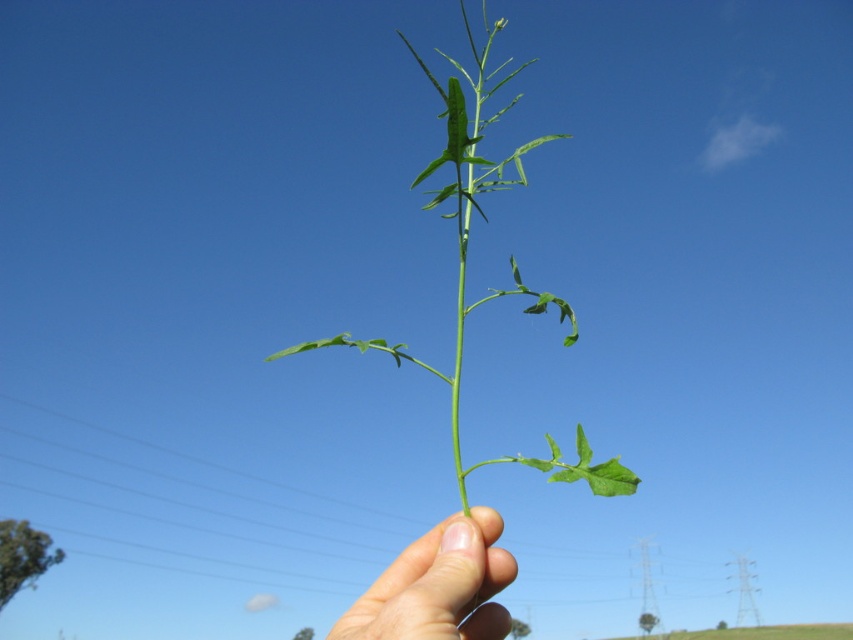
You are a botanist examining a plant specimen. You notice the skinny flesh at center and the green matte leaf at center. Which one is positioned lower in the image?

The skinny flesh at center is below the green matte leaf at center, so the skinny flesh at center is positioned lower in the image.

You are a gardener holding a plant and want to determine which part is thicker between the green leafy stem at center and the skinny flesh at center. Based on the description, which is thicker?

The green leafy stem at center is thicker than the skinny flesh at center.